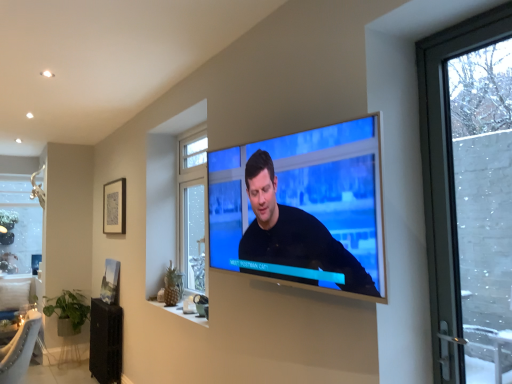
Question: Looking at their shapes, would you say matte black tv at center is wider or thinner than clear glass window at upper left, the first window when ordered from back to front?

Choices:
 (A) wide
 (B) thin

Answer: (A)

Question: Considering their positions, is matte black tv at center located in front of or behind clear glass window at upper left, the 2th window from the front?

Choices:
 (A) behind
 (B) front

Answer: (B)

Question: Which is nearer to the matte black tv at center?

Choices:
 (A) matte black picture frame at upper left, which is the 1th picture frame from top to bottom
 (B) clear glass window at center, marked as the 1th window in a right-to-left arrangement
 (C) clear glass window at upper left, the first window when ordered from back to front
 (D) matte black picture frame at lower left, which ranks as the 1th picture frame in bottom-to-top order

Answer: (B)

Question: Which object is the farthest from the matte black tv at center?

Choices:
 (A) matte black picture frame at lower left, which is the second picture frame from top to bottom
 (B) clear glass window at upper left, which appears as the first window when viewed from the left
 (C) clear glass window at center, which is counted as the first window, starting from the front
 (D) matte black picture frame at upper left, which appears as the 2th picture frame when ordered from the bottom

Answer: (B)